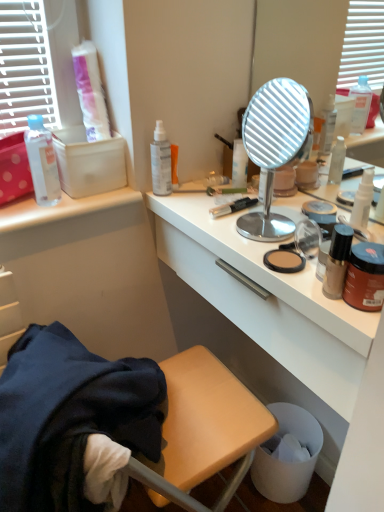
Question: Should I look upward or downward to see matte black bottle at right, the fourth bottle when ordered from back to front?

Choices:
 (A) down
 (B) up

Answer: (A)

Question: Are metallic round mirror at center and brown matte jar at right making contact?

Choices:
 (A) no
 (B) yes

Answer: (A)

Question: Is metallic round mirror at center surrounding brown matte jar at right?

Choices:
 (A) yes
 (B) no

Answer: (B)

Question: Does metallic round mirror at center have a greater height compared to brown matte jar at right?

Choices:
 (A) no
 (B) yes

Answer: (B)

Question: Can you confirm if metallic round mirror at center is positioned to the left of brown matte jar at right?

Choices:
 (A) no
 (B) yes

Answer: (B)

Question: Is the depth of metallic round mirror at center less than that of brown matte jar at right?

Choices:
 (A) no
 (B) yes

Answer: (A)

Question: Is metallic round mirror at center positioned behind brown matte jar at right?

Choices:
 (A) yes
 (B) no

Answer: (A)

Question: Is matte black bottle at right, the 1th bottle positioned from the front, touching wooden stool at lower left?

Choices:
 (A) no
 (B) yes

Answer: (A)

Question: From a real-world perspective, is matte black bottle at right, which is counted as the second bottle, starting from the right, over wooden stool at lower left?

Choices:
 (A) yes
 (B) no

Answer: (A)

Question: Is wooden stool at lower left a part of matte black bottle at right, the 1th bottle positioned from the front?

Choices:
 (A) yes
 (B) no

Answer: (B)

Question: From the image's perspective, is matte black bottle at right, the fourth bottle when ordered from back to front, located beneath wooden stool at lower left?

Choices:
 (A) yes
 (B) no

Answer: (B)

Question: Is matte black bottle at right, the 3th bottle in the left-to-right sequence, bigger than wooden stool at lower left?

Choices:
 (A) yes
 (B) no

Answer: (B)

Question: Does matte black bottle at right, the 1th bottle positioned from the front, have a greater height compared to wooden stool at lower left?

Choices:
 (A) no
 (B) yes

Answer: (A)

Question: Can you confirm if transparent plastic spray bottle at upper center, which ranks as the 3th bottle in right-to-left order, is positioned to the right of transparent plastic bottle at upper left, which is the 1th bottle in left-to-right order?

Choices:
 (A) yes
 (B) no

Answer: (A)